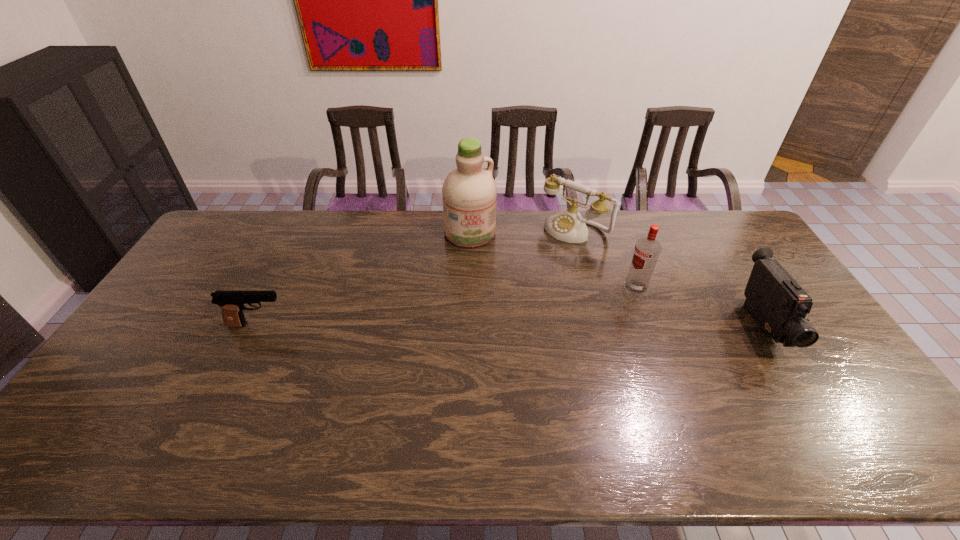
This screenshot has height=540, width=960. In order to click on vacant area that lies between the vodka and the rightmost object in this screenshot , I will do `click(699, 306)`.

At what (x,y) coordinates should I click in order to perform the action: click on free space between the telephone and the rightmost object. Please return your answer as a coordinate pair (x, y). The image size is (960, 540). Looking at the image, I should click on (668, 277).

Locate an element on the screen. free spot between the telephone and the tallest object is located at coordinates (522, 231).

Where is `free space between the telephone and the vodka`? Image resolution: width=960 pixels, height=540 pixels. free space between the telephone and the vodka is located at coordinates (605, 258).

Where is `free space between the tallest object and the telephone`? The width and height of the screenshot is (960, 540). free space between the tallest object and the telephone is located at coordinates (522, 231).

Identify which object is the closest to the shortest object. Please provide its 2D coordinates. Your answer should be formatted as a tuple, i.e. [(x, y)], where the tuple contains the x and y coordinates of a point satisfying the conditions above.

[(469, 192)]

The height and width of the screenshot is (540, 960). I want to click on object that is the third closest one to the second tallest object, so click(469, 192).